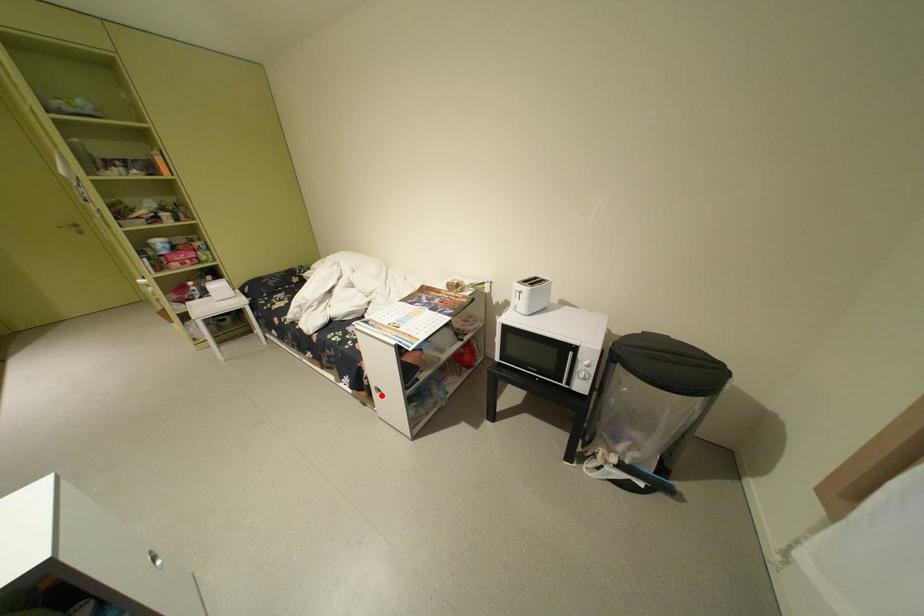
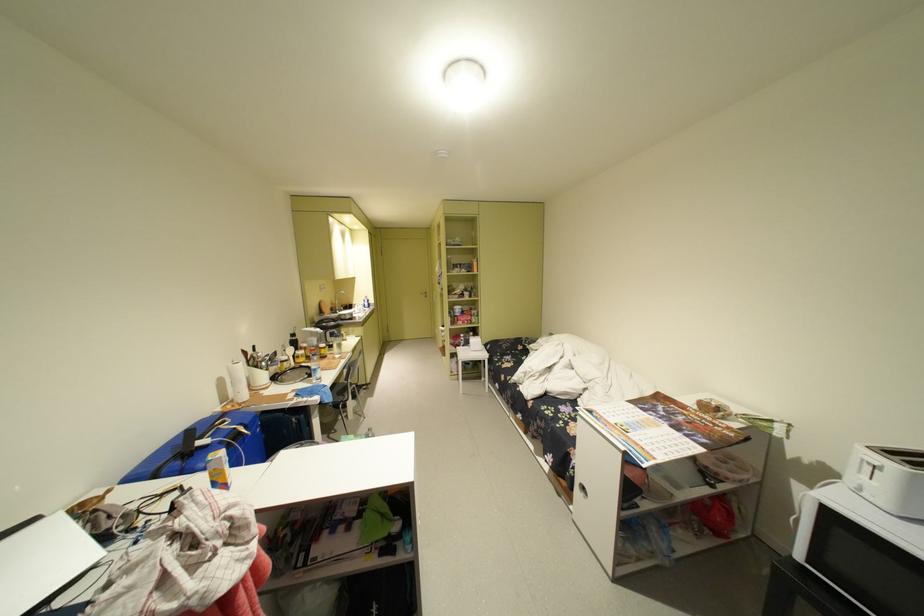
Find the pixel in the second image that matches the highlighted location in the first image.

(582, 488)